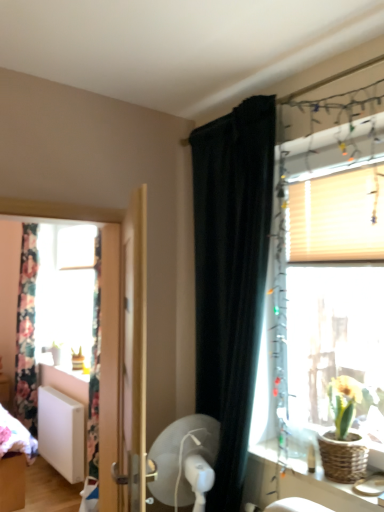
This screenshot has width=384, height=512. I want to click on vacant space underneath green woven basket at right (from a real-world perspective), so click(x=343, y=482).